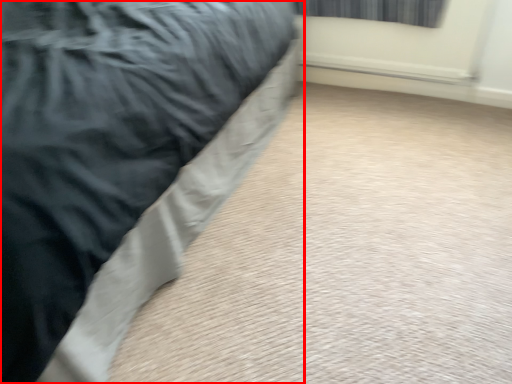
Question: From the image's perspective, considering the relative positions of bed (annotated by the red box) and curtain in the image provided, where is bed (annotated by the red box) located with respect to the staircase?

Choices:
 (A) below
 (B) above

Answer: (A)